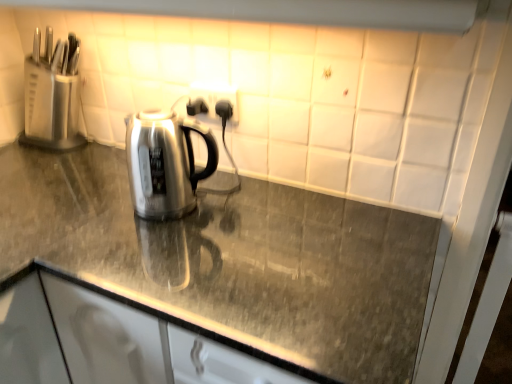
Measure the distance between point (208, 92) and camera.

A distance of 3.73 feet exists between point (208, 92) and camera.

This screenshot has height=384, width=512. Describe the element at coordinates (234, 259) in the screenshot. I see `polished granite countertop at center` at that location.

Image resolution: width=512 pixels, height=384 pixels. Identify the location of black plastic outlet at center. (216, 98).

Consider the image. Can you confirm if polished granite countertop at center is smaller than black plastic outlet at center?

Incorrect, polished granite countertop at center is not smaller in size than black plastic outlet at center.

Is polished granite countertop at center facing towards black plastic outlet at center?

No, polished granite countertop at center does not turn towards black plastic outlet at center.

Where is `countertop on the left of black plastic outlet at center`? This screenshot has width=512, height=384. countertop on the left of black plastic outlet at center is located at coordinates (234, 259).

Can you confirm if white glossy exhaust hood at upper center is smaller than polished granite countertop at center?

Indeed, white glossy exhaust hood at upper center has a smaller size compared to polished granite countertop at center.

From the image's perspective, which is above, white glossy exhaust hood at upper center or polished granite countertop at center?

white glossy exhaust hood at upper center appears higher in the image.

Is polished granite countertop at center oriented towards white glossy exhaust hood at upper center?

No, polished granite countertop at center is not oriented towards white glossy exhaust hood at upper center.

Would you say polished granite countertop at center contains white glossy exhaust hood at upper center?

No, white glossy exhaust hood at upper center is located outside of polished granite countertop at center.

Considering the sizes of polished granite countertop at center and white glossy exhaust hood at upper center in the image, is polished granite countertop at center wider or thinner than white glossy exhaust hood at upper center?

Considering their sizes, polished granite countertop at center looks broader than white glossy exhaust hood at upper center.

Looking at this image, considering the relative positions of polished granite countertop at center and white glossy exhaust hood at upper center in the image provided, is polished granite countertop at center to the left or to the right of white glossy exhaust hood at upper center?

From the image, it's evident that polished granite countertop at center is to the left of white glossy exhaust hood at upper center.

In the scene shown: From a real-world perspective, is black plastic outlet at center physically below white glossy exhaust hood at upper center?

Yes, from a real-world perspective, black plastic outlet at center is below white glossy exhaust hood at upper center.

Which is more to the left, black plastic outlet at center or white glossy exhaust hood at upper center?

Positioned to the left is white glossy exhaust hood at upper center.

From the image's perspective, is black plastic outlet at center over white glossy exhaust hood at upper center?

No, from the image's perspective, black plastic outlet at center is not above white glossy exhaust hood at upper center.

Which is in front, point (212, 89) or point (234, 17)?

The point (234, 17) is closer.

Would you say black plastic outlet at center is a long distance from polished granite countertop at center?

No, black plastic outlet at center is not far from polished granite countertop at center.

Who is taller, black plastic outlet at center or polished granite countertop at center?

polished granite countertop at center is taller.

Is black plastic outlet at center positioned beyond the bounds of polished granite countertop at center?

That's correct, black plastic outlet at center is outside of polished granite countertop at center.

Does point (287, 8) lie behind point (211, 99)?

No, it is not.

This screenshot has height=384, width=512. In order to click on electric outlet behind the white glossy exhaust hood at upper center in this screenshot , I will do `click(216, 98)`.

Considering the sizes of objects white glossy exhaust hood at upper center and black plastic outlet at center in the image provided, who is bigger, white glossy exhaust hood at upper center or black plastic outlet at center?

With larger size is white glossy exhaust hood at upper center.

Locate an element on the screen. Image resolution: width=512 pixels, height=384 pixels. countertop lying below the black plastic outlet at center (from the image's perspective) is located at coordinates pyautogui.click(x=234, y=259).

Locate an element on the screen. This screenshot has width=512, height=384. exhaust hood positioned vertically above the polished granite countertop at center (from a real-world perspective) is located at coordinates click(x=296, y=11).

Based on the photo, based on their spatial positions, is polished granite countertop at center or black plastic outlet at center closer to white glossy exhaust hood at upper center?

black plastic outlet at center lies closer to white glossy exhaust hood at upper center than the other object.

Considering their positions, is white glossy exhaust hood at upper center positioned further to polished granite countertop at center than black plastic outlet at center?

white glossy exhaust hood at upper center lies further to polished granite countertop at center than the other object.

Which object lies further to the anchor point polished granite countertop at center, black plastic outlet at center or white glossy exhaust hood at upper center?

The object further to polished granite countertop at center is white glossy exhaust hood at upper center.

Looking at the image, which one is located further to white glossy exhaust hood at upper center, black plastic outlet at center or polished granite countertop at center?

polished granite countertop at center.

Looking at the image, which one is located closer to black plastic outlet at center, white glossy exhaust hood at upper center or polished granite countertop at center?

white glossy exhaust hood at upper center.

Based on their spatial positions, is polished granite countertop at center or white glossy exhaust hood at upper center closer to black plastic outlet at center?

white glossy exhaust hood at upper center is closer to black plastic outlet at center.

Locate an element on the screen. electric outlet between white glossy exhaust hood at upper center and polished granite countertop at center from top to bottom is located at coordinates (216, 98).